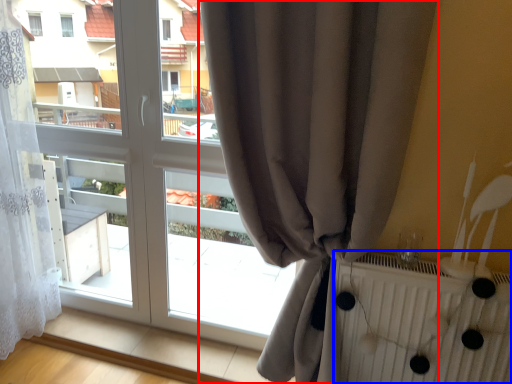
Question: Which of the following is the closest to the observer, curtain (highlighted by a red box) or radiator (highlighted by a blue box)?

Choices:
 (A) curtain
 (B) radiator

Answer: (A)